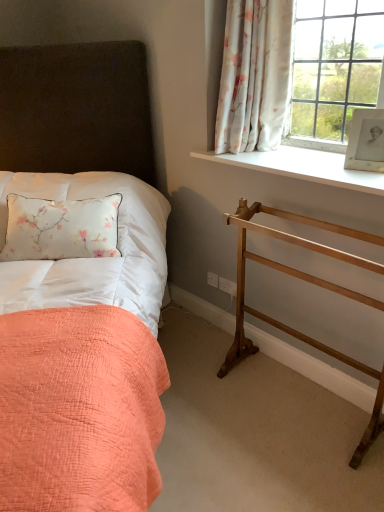
Question: From a real-world perspective, is floral fabric curtain at upper right positioned over wooden balustrade at right based on gravity?

Choices:
 (A) yes
 (B) no

Answer: (A)

Question: Considering the relative positions of floral fabric curtain at upper right and wooden balustrade at right in the image provided, is floral fabric curtain at upper right to the right of wooden balustrade at right from the viewer's perspective?

Choices:
 (A) yes
 (B) no

Answer: (B)

Question: Is floral fabric curtain at upper right in front of wooden balustrade at right?

Choices:
 (A) no
 (B) yes

Answer: (A)

Question: From the image's perspective, is floral fabric curtain at upper right above wooden balustrade at right?

Choices:
 (A) no
 (B) yes

Answer: (B)

Question: From the image's perspective, does floral fabric curtain at upper right appear lower than wooden balustrade at right?

Choices:
 (A) no
 (B) yes

Answer: (A)

Question: Is white smooth window sill at upper right to the left or to the right of wooden balustrade at right in the image?

Choices:
 (A) left
 (B) right

Answer: (B)

Question: Which is correct: white smooth window sill at upper right is inside wooden balustrade at right, or outside of it?

Choices:
 (A) outside
 (B) inside

Answer: (A)

Question: Relative to wooden balustrade at right, is white smooth window sill at upper right in front or behind?

Choices:
 (A) front
 (B) behind

Answer: (B)

Question: In terms of size, does white smooth window sill at upper right appear bigger or smaller than wooden balustrade at right?

Choices:
 (A) big
 (B) small

Answer: (B)

Question: Looking at the image, does wooden balustrade at right seem bigger or smaller compared to white paper photo frame at upper right?

Choices:
 (A) small
 (B) big

Answer: (B)

Question: Is wooden balustrade at right taller or shorter than white paper photo frame at upper right?

Choices:
 (A) tall
 (B) short

Answer: (A)

Question: From a real-world perspective, relative to white paper photo frame at upper right, is wooden balustrade at right vertically above or below?

Choices:
 (A) above
 (B) below

Answer: (B)

Question: Looking at their shapes, would you say wooden balustrade at right is wider or thinner than white paper photo frame at upper right?

Choices:
 (A) thin
 (B) wide

Answer: (B)

Question: In terms of width, does matte fabric bed at left look wider or thinner when compared to wooden balustrade at right?

Choices:
 (A) thin
 (B) wide

Answer: (B)

Question: Is point (94, 230) positioned closer to the camera than point (258, 228)?

Choices:
 (A) farther
 (B) closer

Answer: (A)